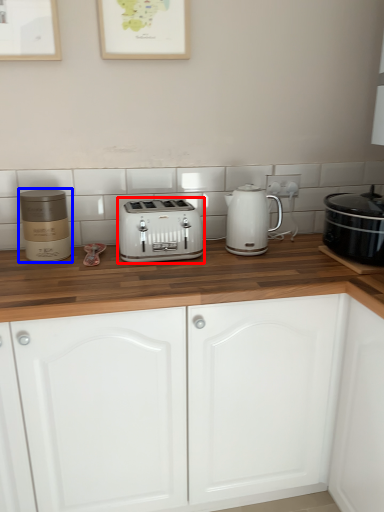
Question: Which point is closer to the camera, toaster (highlighted by a red box) or appliance (highlighted by a blue box)?

Choices:
 (A) toaster
 (B) appliance

Answer: (B)